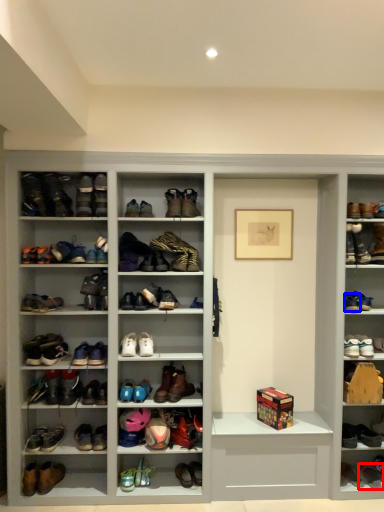
Question: Which point is closer to the camera, footwear (highlighted by a red box) or footwear (highlighted by a blue box)?

Choices:
 (A) footwear
 (B) footwear

Answer: (B)